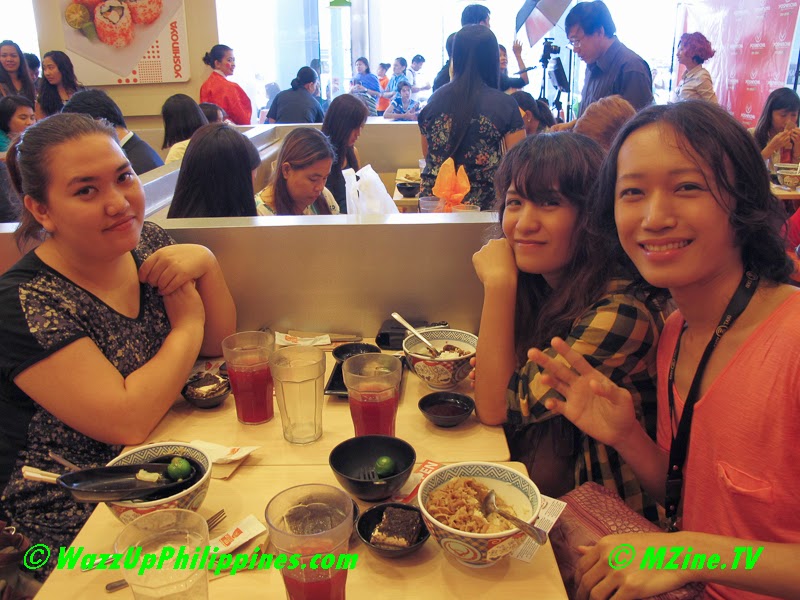
Where is `spoon handle`? The height and width of the screenshot is (600, 800). spoon handle is located at coordinates (530, 528), (396, 316).